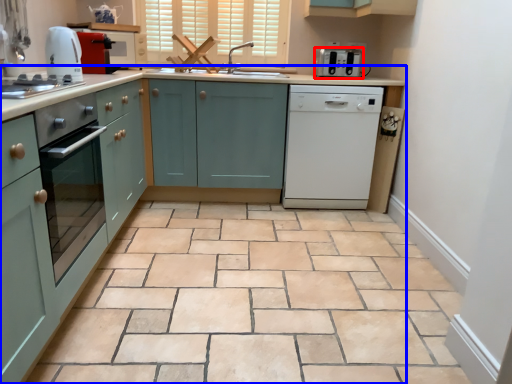
Question: Among these objects, which one is farthest to the camera, kitchen appliance (highlighted by a red box) or countertop (highlighted by a blue box)?

Choices:
 (A) kitchen appliance
 (B) countertop

Answer: (A)